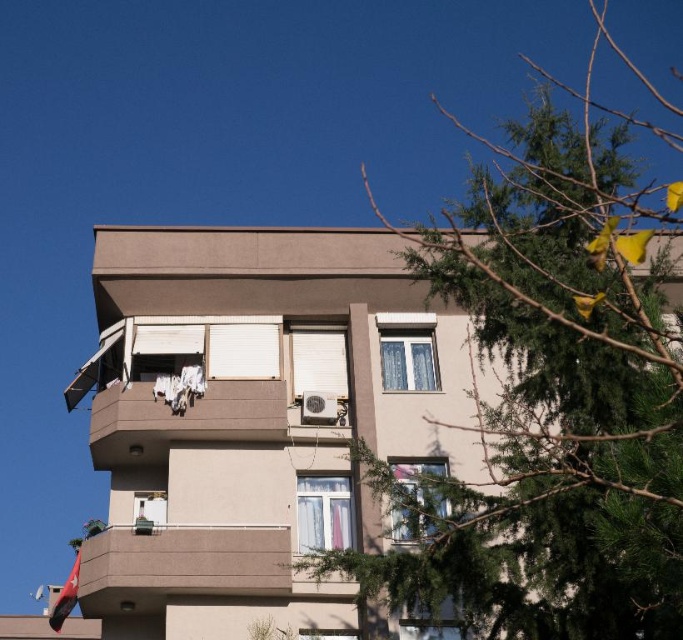
Which of these two, smooth concrete balcony at lower center or white sheer curtains at upper right, stands taller?

Standing taller between the two is smooth concrete balcony at lower center.

The image size is (683, 640). What are the coordinates of `smooth concrete balcony at lower center` in the screenshot? It's located at (180, 564).

Can you confirm if smooth concrete balcony at lower center is bigger than transparent glass window at center?

No, smooth concrete balcony at lower center is not bigger than transparent glass window at center.

Where is `smooth concrete balcony at lower center`? The height and width of the screenshot is (640, 683). smooth concrete balcony at lower center is located at coordinates (180, 564).

Between point (156, 541) and point (408, 525), which one is positioned in front?

Point (408, 525)

At what (x,y) coordinates should I click in order to perform the action: click on smooth concrete balcony at lower center. Please return your answer as a coordinate pair (x, y). Looking at the image, I should click on (180, 564).

Does white sheer curtain at center lie in front of clear glass window at lower right?

No, white sheer curtain at center is behind clear glass window at lower right.

Between point (316, 532) and point (458, 628), which one is positioned behind?

The point (316, 532) is more distant.

Find the location of a particular element. The image size is (683, 640). white sheer curtain at center is located at coordinates (322, 513).